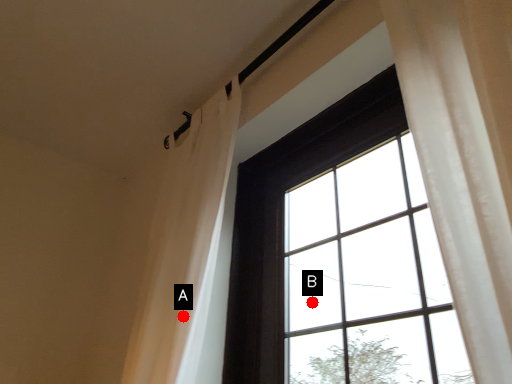
Question: Two points are circled on the image, labeled by A and B beside each circle. Which point is closer to the camera?

Choices:
 (A) A is closer
 (B) B is closer

Answer: (A)